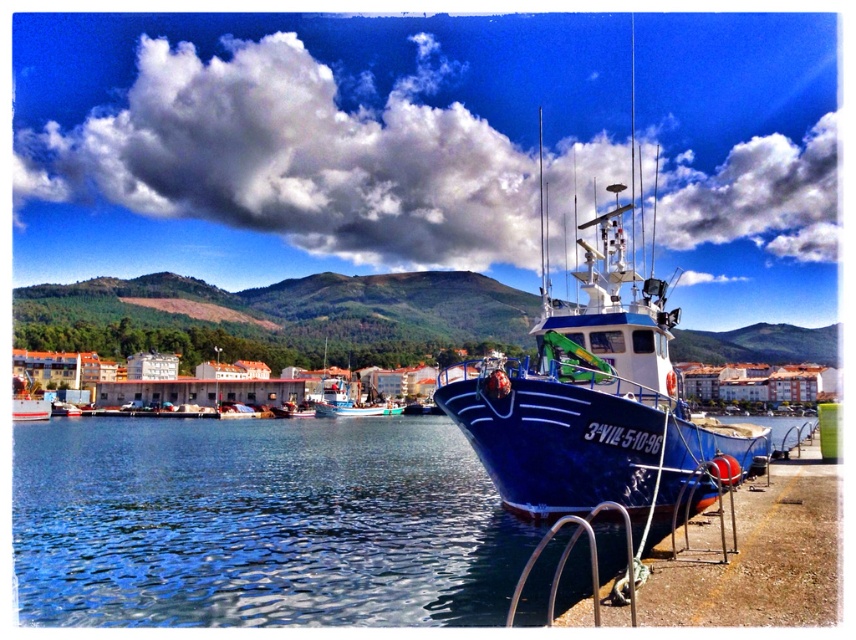
Locate an element on the screen. blue water at lower center is located at coordinates (259, 524).

Is blue water at lower center shorter than white glossy boat at lower left?

In fact, blue water at lower center may be taller than white glossy boat at lower left.

Where is `blue water at lower center`? blue water at lower center is located at coordinates (259, 524).